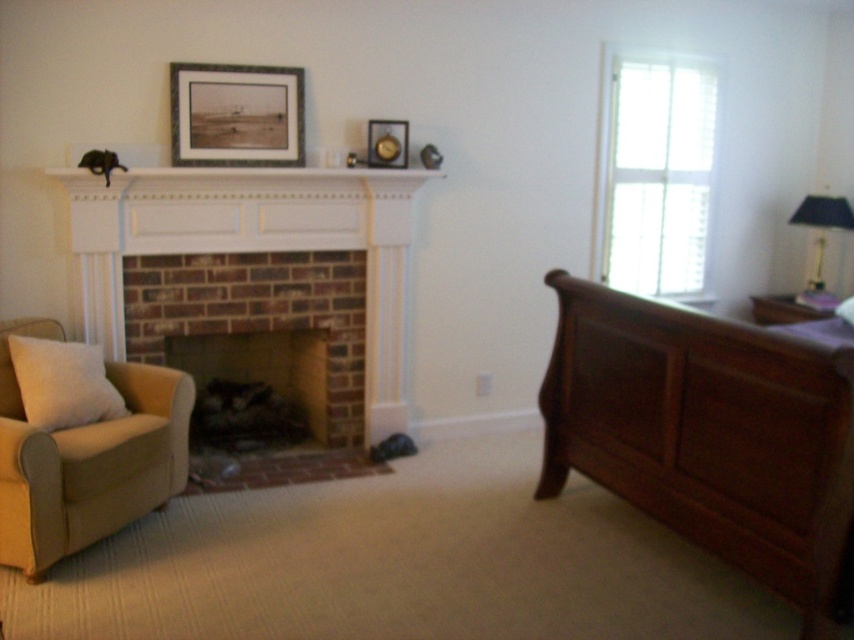
Does beige fabric armchair at left have a larger size compared to matte black picture frame at upper center?

Indeed, beige fabric armchair at left has a larger size compared to matte black picture frame at upper center.

Who is taller, beige fabric armchair at left or matte black picture frame at upper center?

beige fabric armchair at left

Find the location of a particular element. The width and height of the screenshot is (854, 640). beige fabric armchair at left is located at coordinates (86, 460).

Is beige fabric pillow at lower left bigger than metallic gold picture frame at upper center?

Yes, beige fabric pillow at lower left is bigger than metallic gold picture frame at upper center.

Between point (48, 401) and point (381, 138), which one is positioned in front?

Positioned in front is point (48, 401).

Image resolution: width=854 pixels, height=640 pixels. Identify the location of beige fabric pillow at lower left. (62, 384).

Which is more to the right, beige fabric armchair at left or metallic gold picture frame at upper center?

metallic gold picture frame at upper center

Does beige fabric armchair at left appear on the right side of metallic gold picture frame at upper center?

In fact, beige fabric armchair at left is to the left of metallic gold picture frame at upper center.

Which is in front, point (4, 332) or point (393, 150)?

Point (4, 332)

Where is `beige fabric armchair at left`? The height and width of the screenshot is (640, 854). beige fabric armchair at left is located at coordinates (86, 460).